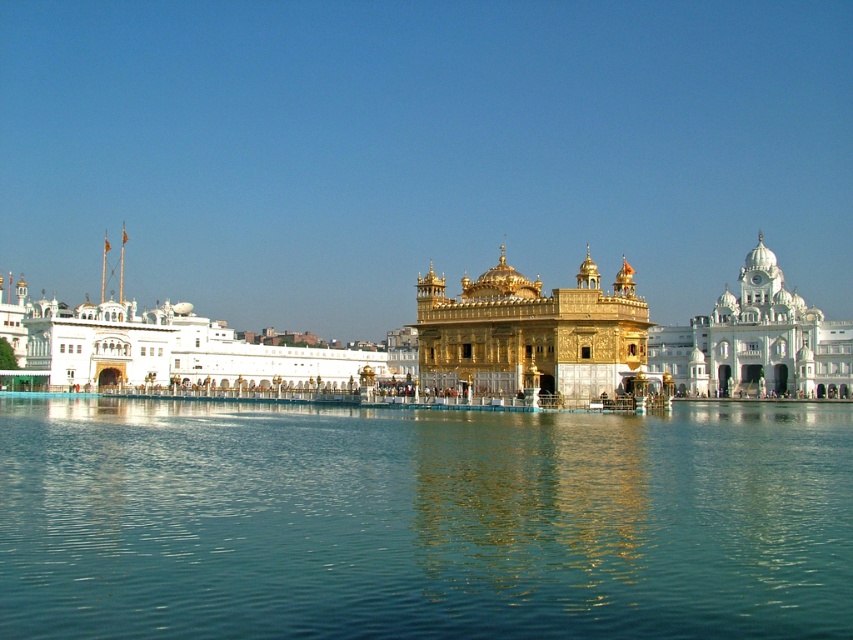
Between point (323, 540) and point (718, 376), which one is positioned in front?

Point (323, 540)

Is transparent blue water at center above white marble palace at right?

No, transparent blue water at center is not above white marble palace at right.

Is point (20, 595) positioned in front of point (746, 289)?

That is True.

Locate an element on the screen. transparent blue water at center is located at coordinates (422, 522).

Is golden polished dome at center taller than white marble palace at right?

In fact, golden polished dome at center may be shorter than white marble palace at right.

Is golden polished dome at center positioned at the back of white marble palace at right?

No, golden polished dome at center is closer to the viewer.

Locate an element on the screen. The width and height of the screenshot is (853, 640). golden polished dome at center is located at coordinates pyautogui.click(x=532, y=333).

Can you confirm if golden polished dome at center is wider than gold ornate palace at center?

Yes.

Describe the element at coordinates (532, 333) in the screenshot. I see `golden polished dome at center` at that location.

You are a GUI agent. You are given a task and a screenshot of the screen. Output one action in this format:
    pyautogui.click(x=<x>, y=<y>)
    Task: Click on the golden polished dome at center
    
    Given the screenshot: What is the action you would take?
    pyautogui.click(x=532, y=333)